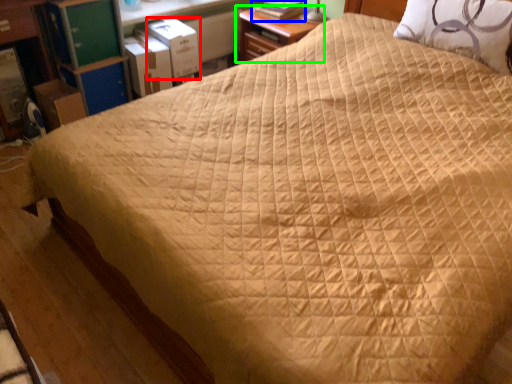
Question: Considering the real-world distances, which object is farthest from cardboard box (highlighted by a red box)? book (highlighted by a blue box) or nightstand (highlighted by a green box)?

Choices:
 (A) book
 (B) nightstand

Answer: (A)